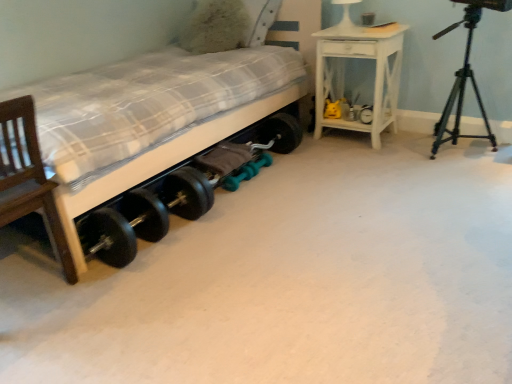
Identify the location of free location to the left of black metal tripod at right. (404, 160).